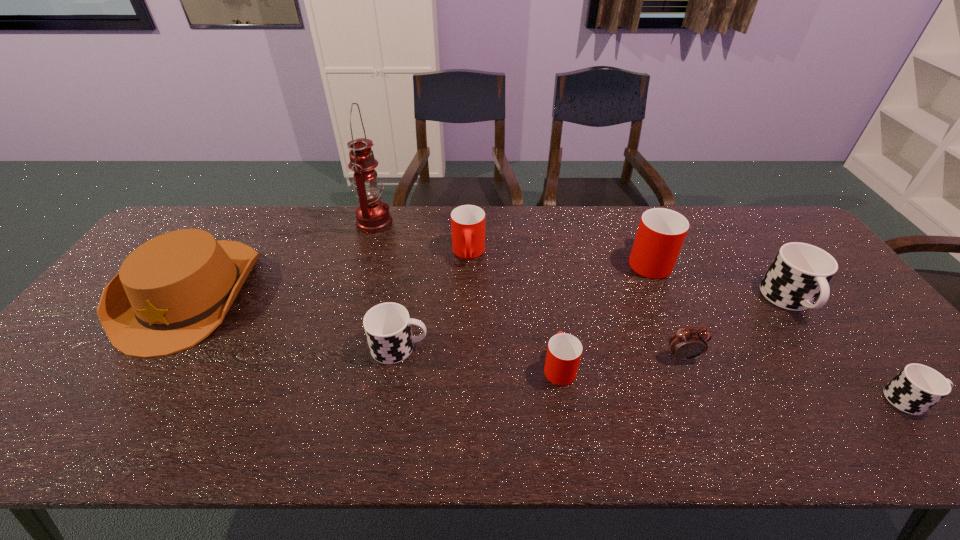
This screenshot has height=540, width=960. I want to click on empty space between the eighth object from right to left and the second nearest black cup, so click(387, 285).

The height and width of the screenshot is (540, 960). What are the coordinates of `unoccupied position between the eighth object from right to left and the nearest black cup` in the screenshot? It's located at (642, 311).

You are a GUI agent. You are given a task and a screenshot of the screen. Output one action in this format:
    pyautogui.click(x=<x>, y=<y>)
    Task: Click on the free space between the farthest black cup and the fourth cup from right to left
    
    Given the screenshot: What is the action you would take?
    pyautogui.click(x=674, y=334)

This screenshot has width=960, height=540. I want to click on free spot between the farthest black cup and the second biggest black cup, so click(594, 324).

Where is `free space between the second cup from left to right and the farthest black cup`? The height and width of the screenshot is (540, 960). free space between the second cup from left to right and the farthest black cup is located at coordinates (629, 276).

You are a GUI agent. You are given a task and a screenshot of the screen. Output one action in this format:
    pyautogui.click(x=<x>, y=<y>)
    Task: Click on the vacant space in between the rightmost red cup and the nearest black cup
    The width and height of the screenshot is (960, 540).
    Given the screenshot: What is the action you would take?
    pyautogui.click(x=779, y=329)

Identify the location of empty space that is in between the second red cup from left to right and the second object from left to right. The width and height of the screenshot is (960, 540). (467, 295).

In order to click on object that stands as the fourth closest to the fifth cup from right to left in this screenshot , I will do [661, 232].

Point out which object is positioned as the nearest to the alarm clock. Please provide its 2D coordinates. Your answer should be formatted as a tuple, i.e. [(x, y)], where the tuple contains the x and y coordinates of a point satisfying the conditions above.

[(564, 351)]

I want to click on cup that is the second nearest to the leftmost red cup, so click(x=564, y=351).